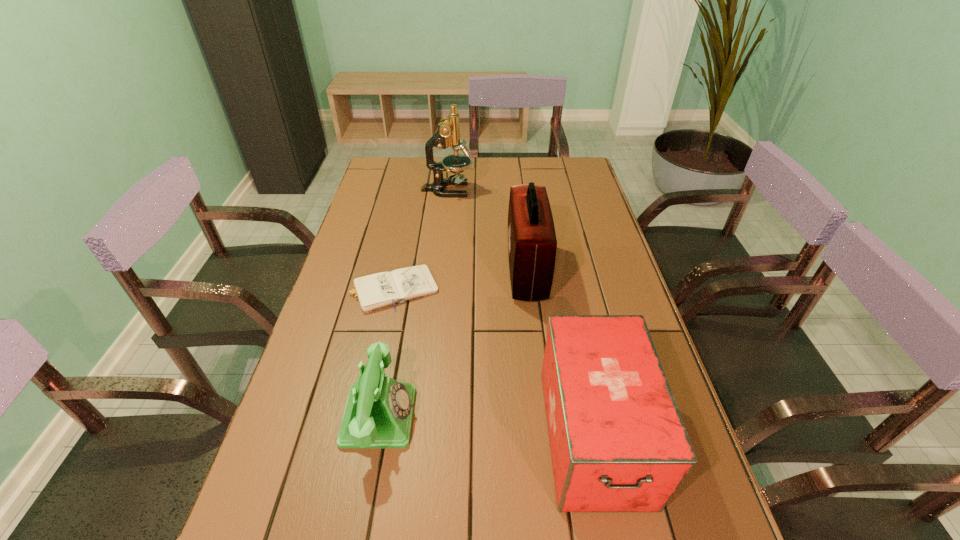
Point out which object is positioned as the second nearest to the farthest object. Please provide its 2D coordinates. Your answer should be formatted as a tuple, i.e. [(x, y)], where the tuple contains the x and y coordinates of a point satisfying the conditions above.

[(375, 291)]

The width and height of the screenshot is (960, 540). I want to click on object that stands as the fourth closest to the taller first-aid kit, so click(378, 414).

Locate an element on the screen. The image size is (960, 540). vacant region that satisfies the following two spatial constraints: 1. at the eyepiece of the microscope; 2. on the front side of the notebook is located at coordinates (437, 289).